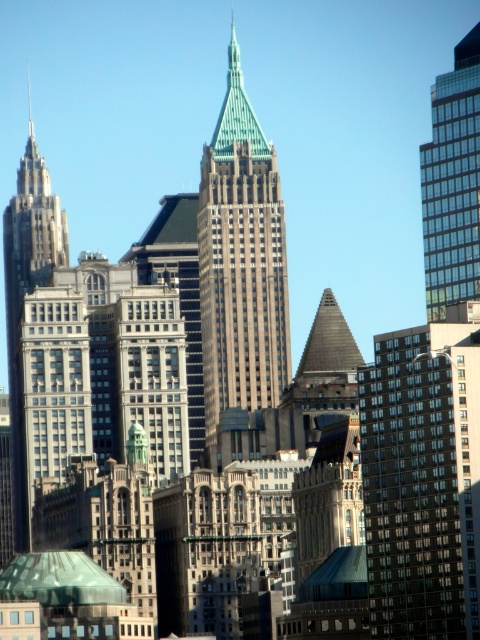
The height and width of the screenshot is (640, 480). Find the location of `green-tipped skyscraper at center`. green-tipped skyscraper at center is located at coordinates (240, 264).

Is green-tipped skyscraper at center wider than glassy reflective skyscraper at right?

Correct, the width of green-tipped skyscraper at center exceeds that of glassy reflective skyscraper at right.

Where is `green-tipped skyscraper at center`? The width and height of the screenshot is (480, 640). green-tipped skyscraper at center is located at coordinates (240, 264).